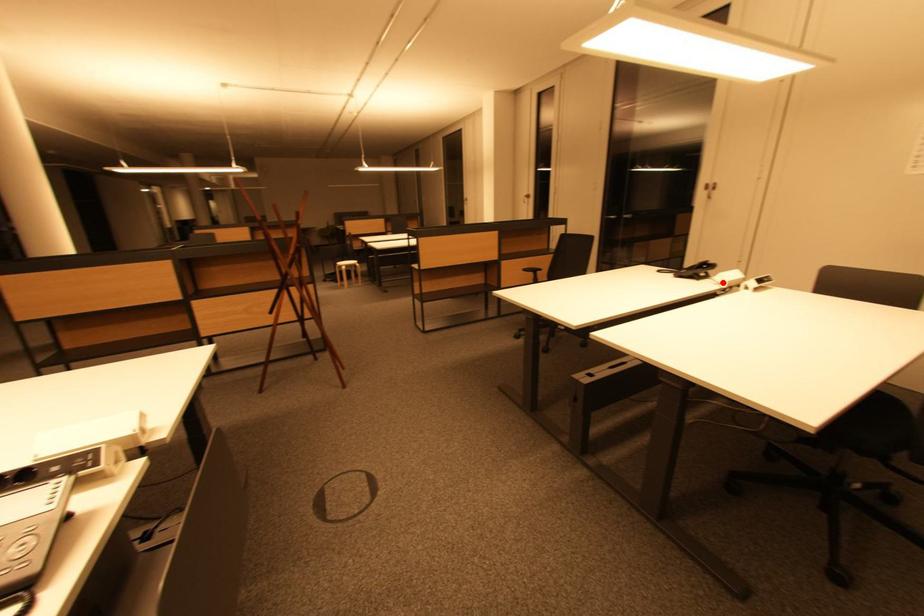
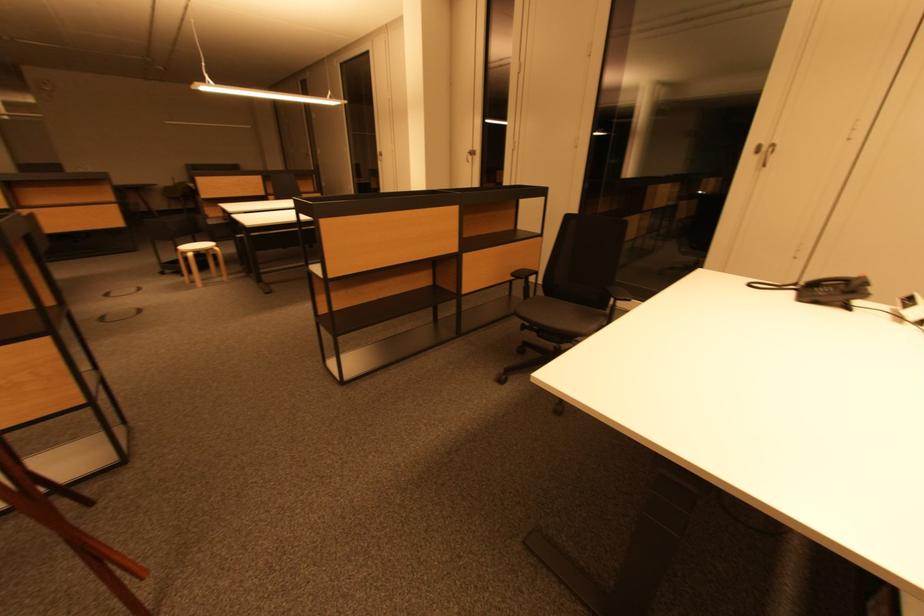
In the second image, find the point that corresponds to the highlighted location in the first image.

(918, 320)